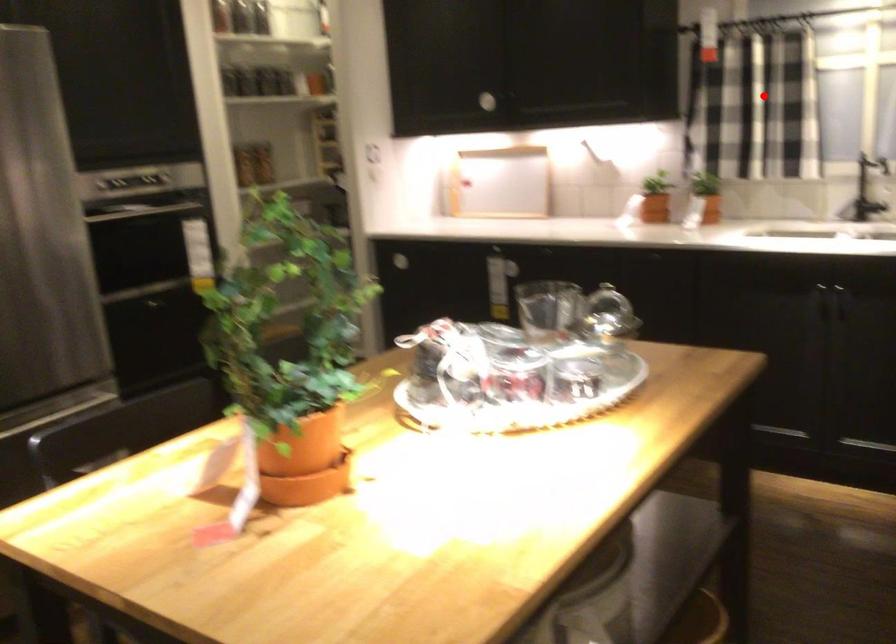
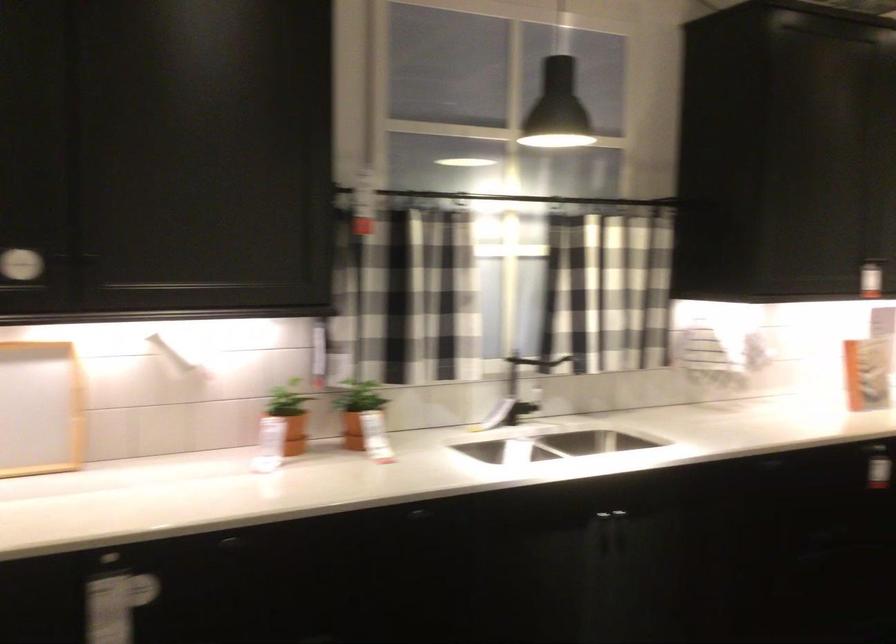
Find the pixel in the second image that matches the highlighted location in the first image.

(403, 295)